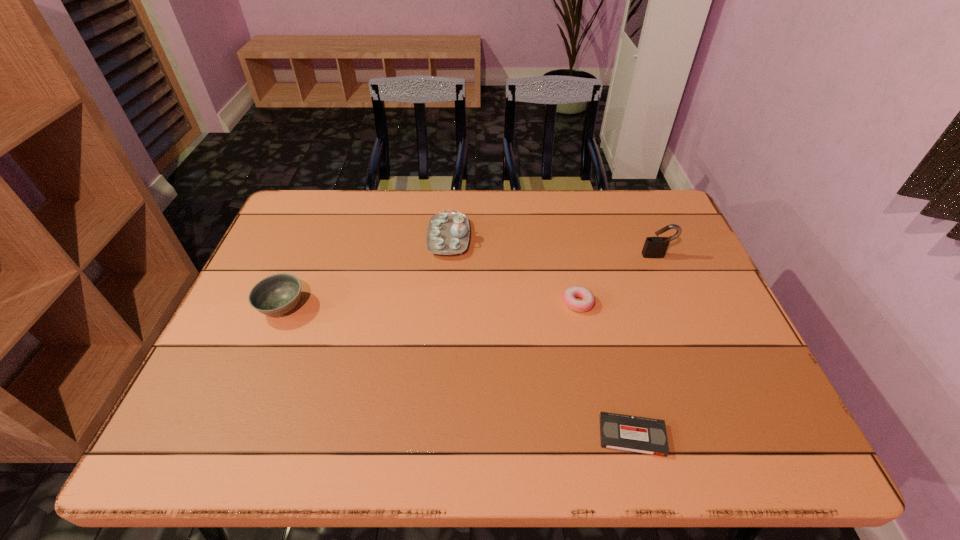
Find the location of a particular element. free location located on the left of the chinaware is located at coordinates (355, 238).

At what (x,y) coordinates should I click in order to perform the action: click on vacant region located 0.380m on the back of the bowl. Please return your answer as a coordinate pair (x, y). The height and width of the screenshot is (540, 960). Looking at the image, I should click on (324, 206).

At what (x,y) coordinates should I click in order to perform the action: click on free spot located on the front of the doughnut. Please return your answer as a coordinate pair (x, y). This screenshot has height=540, width=960. Looking at the image, I should click on [x=591, y=368].

Identify the location of vacant space positioned 0.250m on the back of the nearest object. This screenshot has height=540, width=960. (604, 323).

Where is `object located in the far edge section of the desktop`? This screenshot has width=960, height=540. object located in the far edge section of the desktop is located at coordinates (448, 233).

At what (x,y) coordinates should I click in order to perform the action: click on object that is at the near edge. Please return your answer as a coordinate pair (x, y). Looking at the image, I should click on (643, 435).

Where is `object located in the left edge section of the desktop`? The image size is (960, 540). object located in the left edge section of the desktop is located at coordinates (277, 294).

The image size is (960, 540). What are the coordinates of `object that is at the right edge` in the screenshot? It's located at (654, 247).

This screenshot has width=960, height=540. Identify the location of vacant region at the far edge of the desktop. (502, 234).

In the image, there is a desktop. Find the location of `vacant space at the near edge`. vacant space at the near edge is located at coordinates (709, 446).